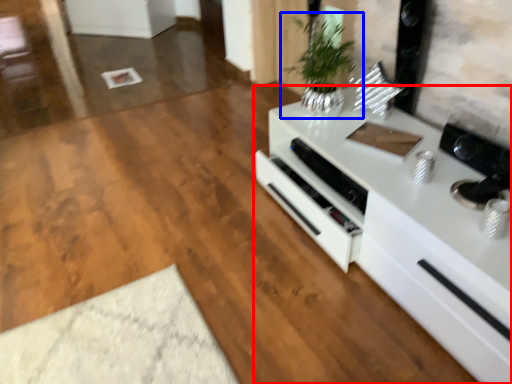
Question: Among these objects, which one is farthest to the camera, countertop (highlighted by a red box) or houseplant (highlighted by a blue box)?

Choices:
 (A) countertop
 (B) houseplant

Answer: (B)